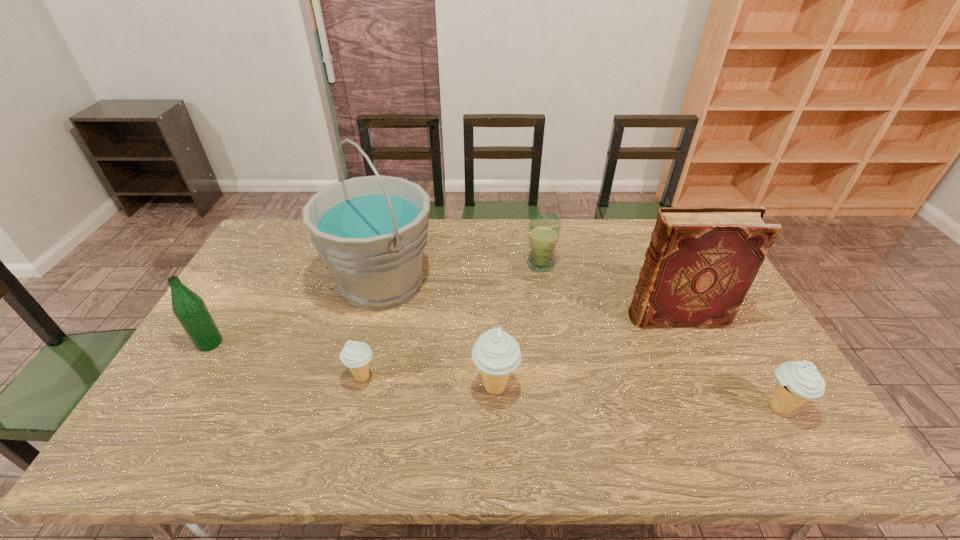
Choose which icecream is the third nearest neighbor to the fourth nearest object. Please provide its 2D coordinates. Your answer should be formatted as a tuple, i.e. [(x, y)], where the tuple contains the x and y coordinates of a point satisfying the conditions above.

[(798, 381)]

You are a GUI agent. You are given a task and a screenshot of the screen. Output one action in this format:
    pyautogui.click(x=<x>, y=<y>)
    Task: Click on the vacant space that satisfies the following two spatial constraints: 1. on the spine side of the hardback book; 2. on the back side of the second tallest icecream
    This screenshot has height=540, width=960.
    Given the screenshot: What is the action you would take?
    pyautogui.click(x=718, y=408)

I want to click on vacant position in the image that satisfies the following two spatial constraints: 1. on the spine side of the second tallest object; 2. on the front side of the leftmost icecream, so click(704, 377).

You are a GUI agent. You are given a task and a screenshot of the screen. Output one action in this format:
    pyautogui.click(x=<x>, y=<y>)
    Task: Click on the vacant space that satisfies the following two spatial constraints: 1. on the front side of the shortest icecream; 2. on the right side of the bucket
    Image resolution: width=960 pixels, height=540 pixels.
    Given the screenshot: What is the action you would take?
    pyautogui.click(x=358, y=377)

Locate an element on the screen. This screenshot has height=540, width=960. vacant space that satisfies the following two spatial constraints: 1. on the spine side of the hardback book; 2. on the front side of the shortest object is located at coordinates (704, 377).